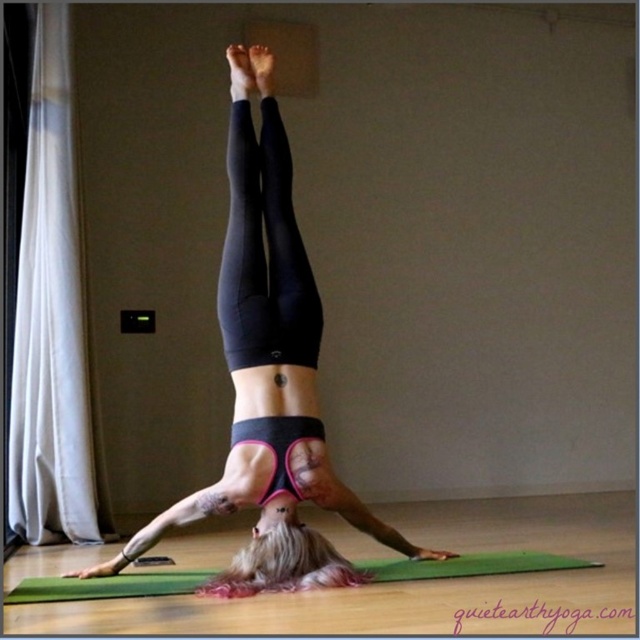
You are an interior designer analyzing the placement of objects in the room. Based on the coordinates provided, where is the black matte leggings at center located in the image?

The black matte leggings at center is located at the coordinates point (268, 372).

You are a photographer setting up a shoot in the room where the person is doing a headstand. You need to place two lights at the given points. The first light is at point (296, 493) and the second at point (92, 593). Which light is closer to the wall where the person is balancing their feet?

Point (92, 593) is closer to the wall where the person is balancing their feet because point (296, 493) is behind it.

You are a physical therapist analyzing a yoga pose. You notice the black matte leggings at center and the green rubber yoga mat at center. Which object is positioned higher in the image?

The black matte leggings at center is located above the green rubber yoga mat at center, so it is positioned higher in the image.